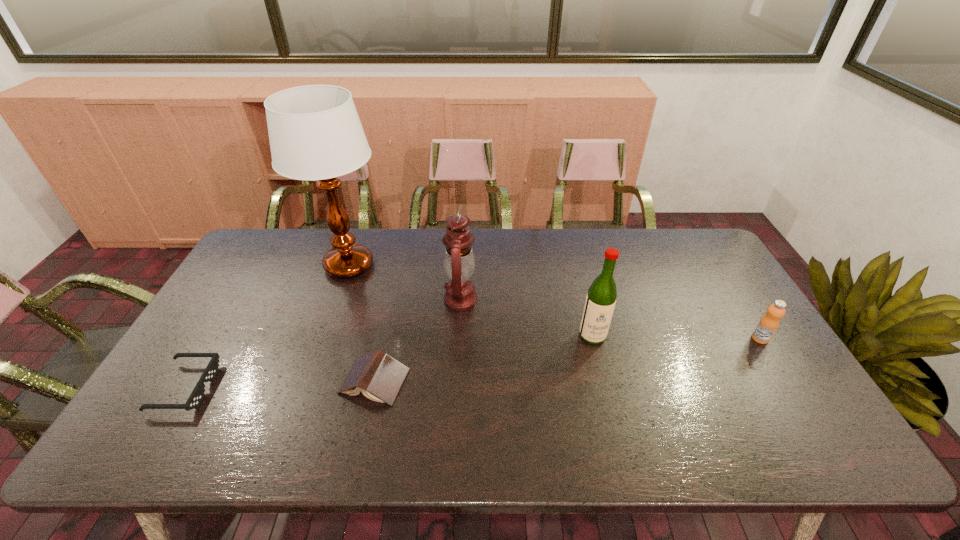
In order to click on the tallest object in this screenshot , I will do `click(315, 133)`.

Locate an element on the screen. The width and height of the screenshot is (960, 540). oil lamp is located at coordinates (459, 263).

What are the coordinates of `liquor` in the screenshot? It's located at (600, 302).

Locate an element on the screen. The image size is (960, 540). the rightmost object is located at coordinates (768, 324).

Locate an element on the screen. This screenshot has height=540, width=960. the fourth tallest object is located at coordinates (768, 324).

Locate an element on the screen. The image size is (960, 540). book is located at coordinates (379, 377).

The width and height of the screenshot is (960, 540). I want to click on sunglasses, so [197, 395].

Where is `the leftmost object`? the leftmost object is located at coordinates (197, 395).

At what (x,y) coordinates should I click in order to perform the action: click on vacant space situated 0.400m on the front of the table lamp. Please return your answer as a coordinate pair (x, y). This screenshot has width=960, height=540. Looking at the image, I should click on (300, 403).

I want to click on blank space located 0.270m on the back of the oil lamp, so click(x=464, y=234).